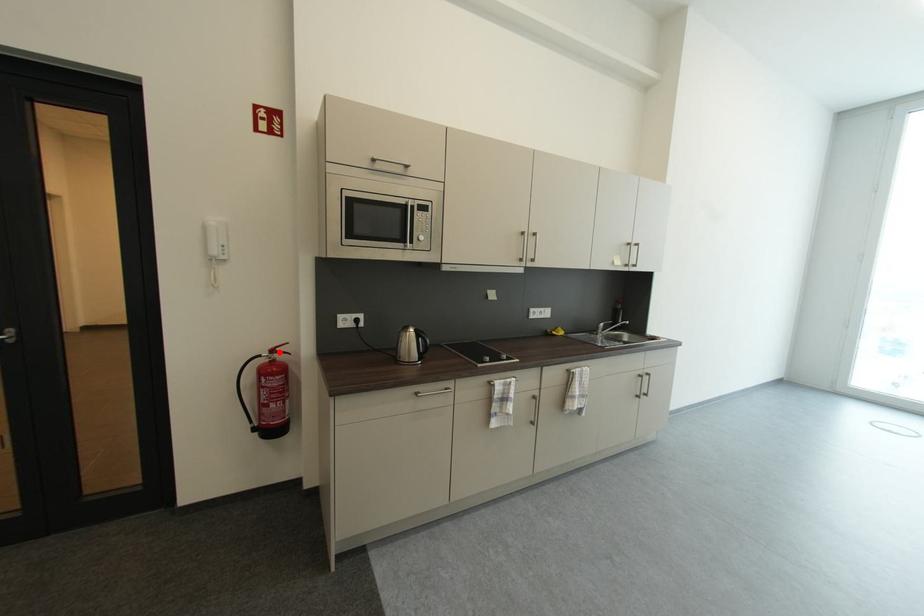
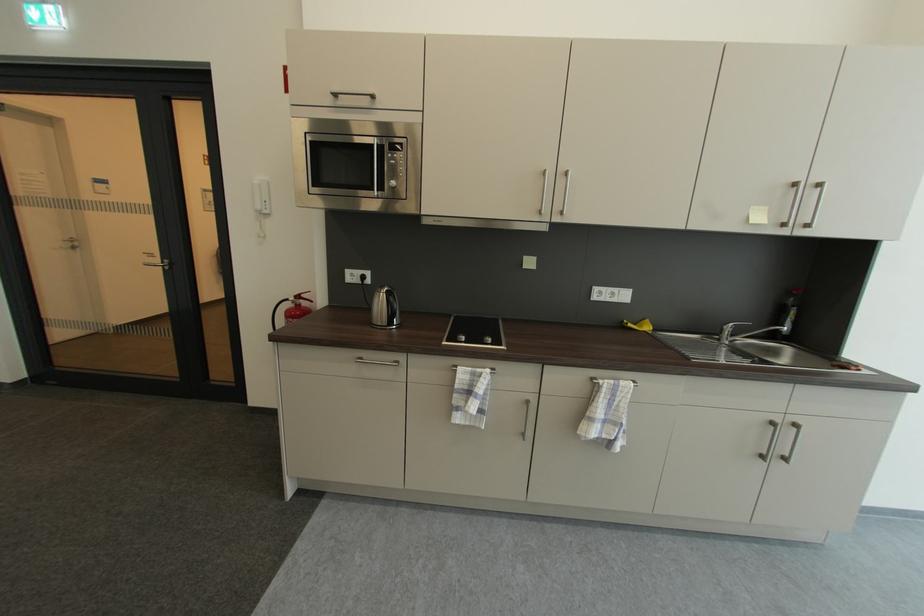
Find the pixel in the second image that matches the highlighted location in the first image.

(305, 299)